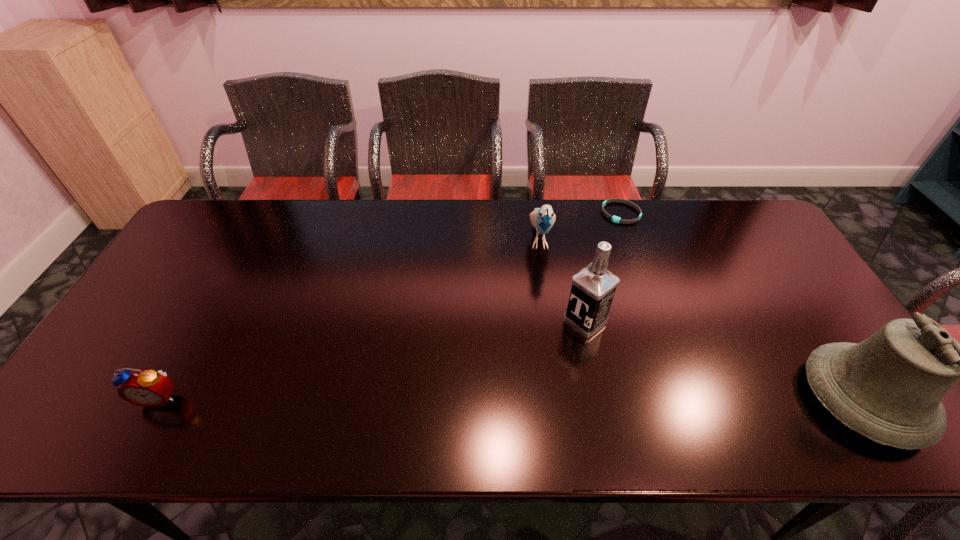
This screenshot has width=960, height=540. What are the coordinates of `vacant space that is in between the shortest object and the fourth tallest object` in the screenshot? It's located at (391, 305).

Find the location of `vacant point located between the leftmost object and the shortest object`. vacant point located between the leftmost object and the shortest object is located at coordinates (391, 305).

This screenshot has height=540, width=960. I want to click on free space between the third shortest object and the second shortest object, so click(349, 318).

Identify the location of object that stands as the third closest to the bell. (543, 218).

Locate an element on the screen. The image size is (960, 540). the third closest object to the fourth object from left to right is located at coordinates (889, 388).